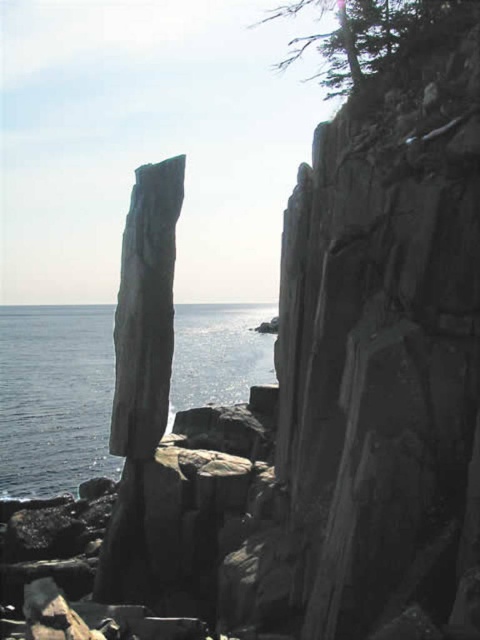
You are standing on the cliff and looking at the blue water at center and the green textured tree at upper center. Which object is located higher up in the scene?

The green textured tree at upper center is located higher up in the scene than the blue water at center.

In the scene shown: You are standing on the cliff looking out at the ocean. There is a specific point marked at coordinates point (x=55, y=397). Based on the scene description, what is the color and location of the object at that point?

The point (x=55, y=397) corresponds to blue water at center as described in the objects description.